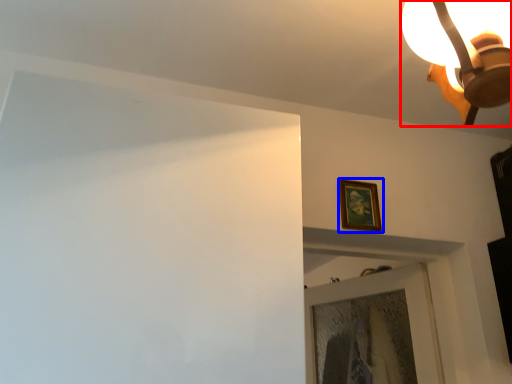
Question: Which object is closer to the camera taking this photo, lamp (highlighted by a red box) or picture frame (highlighted by a blue box)?

Choices:
 (A) lamp
 (B) picture frame

Answer: (A)